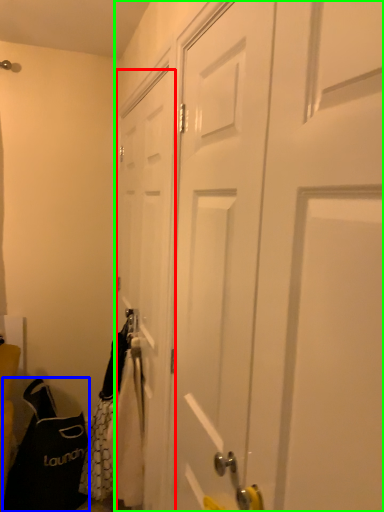
Question: Which is nearer to the door (highlighted by a red box)? shoulder bag (highlighted by a blue box) or door (highlighted by a green box).

Choices:
 (A) shoulder bag
 (B) door

Answer: (B)